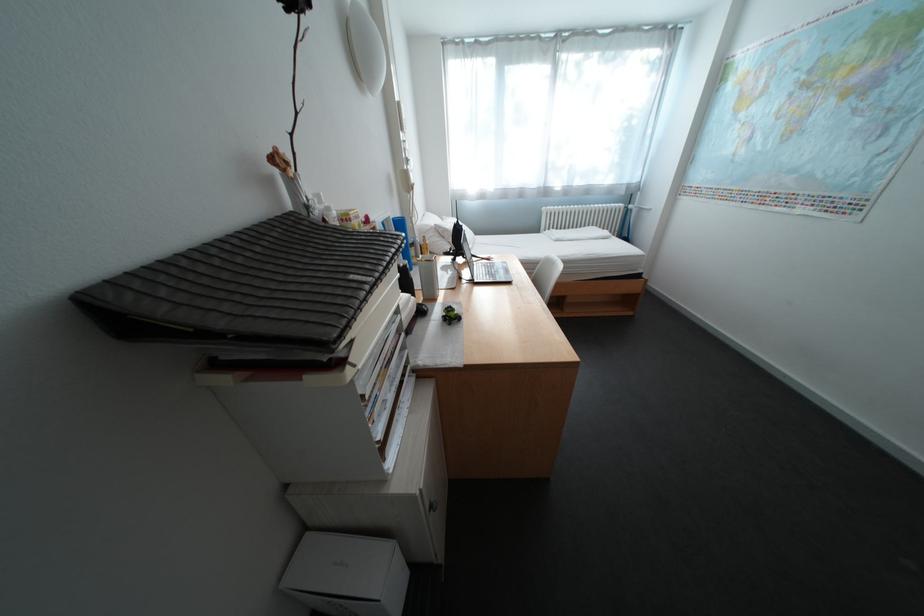
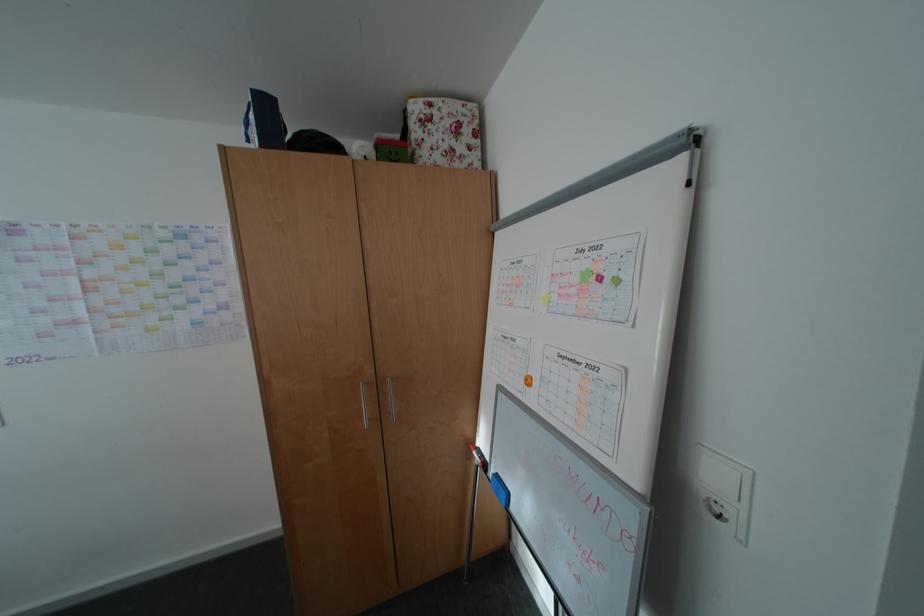
Question: The images are taken continuously from a first-person perspective. In which direction is your viewpoint rotating?

Choices:
 (A) Left
 (B) Right
 (C) Up
 (D) Down

Answer: (B)